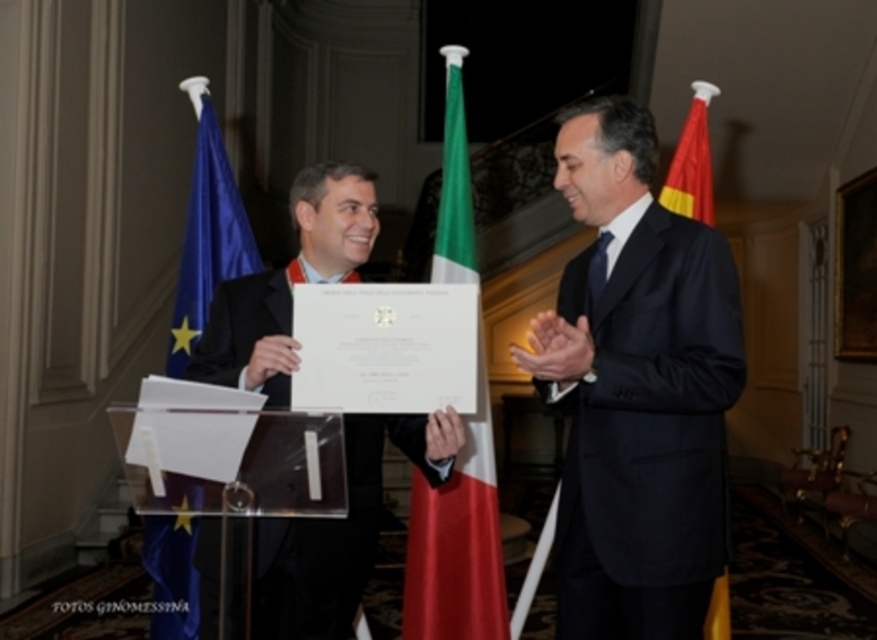
Question: Which object is positioned closest to the blue fabric flag at left?

Choices:
 (A) green fabric flag at center
 (B) red fabric flag at right
 (C) matte black suit at center

Answer: (C)

Question: Where is black suit at center located in relation to blue fabric flag at left in the image?

Choices:
 (A) right
 (B) left

Answer: (A)

Question: Which of the following is the closest to the observer?

Choices:
 (A) (196, 339)
 (B) (579, 380)

Answer: (B)

Question: From the image, what is the correct spatial relationship of matte black suit at center in relation to red fabric flag at right?

Choices:
 (A) above
 (B) below

Answer: (B)

Question: Estimate the real-world distances between objects in this image. Which object is closer to the blue fabric flag at left?

Choices:
 (A) red fabric flag at right
 (B) black suit at center
 (C) matte black suit at center

Answer: (C)

Question: Considering the relative positions of black suit at center and green fabric flag at center in the image provided, where is black suit at center located with respect to green fabric flag at center?

Choices:
 (A) left
 (B) right

Answer: (B)